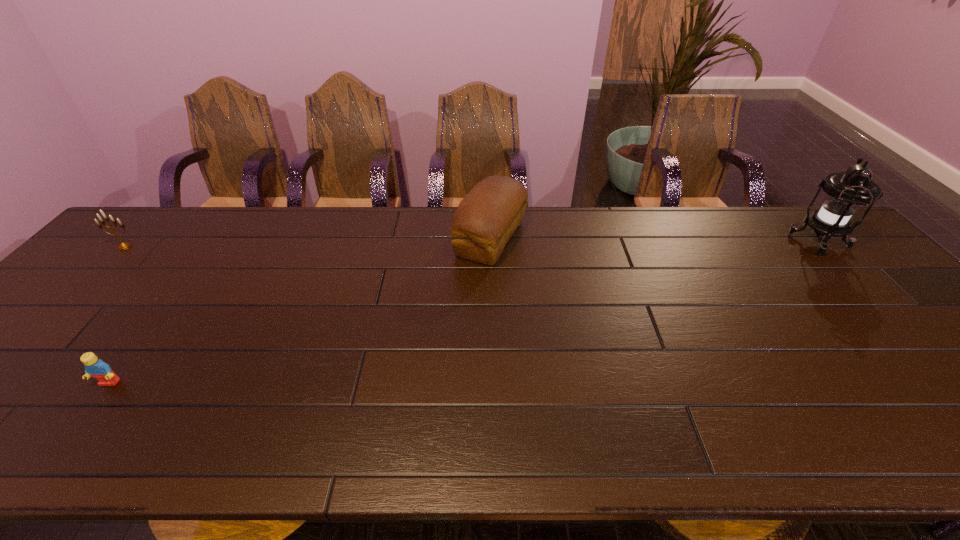
Locate an element on the screen. This screenshot has width=960, height=540. the rightmost object is located at coordinates (846, 191).

Where is `the tallest object`? This screenshot has width=960, height=540. the tallest object is located at coordinates (846, 191).

Locate an element on the screen. the third shortest object is located at coordinates (488, 216).

This screenshot has height=540, width=960. I want to click on bread, so click(x=488, y=216).

The image size is (960, 540). I want to click on candelabrum, so click(x=123, y=246).

This screenshot has width=960, height=540. In order to click on the second shortest object in this screenshot , I will do `click(123, 246)`.

You are a GUI agent. You are given a task and a screenshot of the screen. Output one action in this format:
    pyautogui.click(x=<x>, y=<y>)
    Task: Click on the third object from right to left
    This screenshot has height=540, width=960.
    Given the screenshot: What is the action you would take?
    [95, 367]

Where is `the nearest object`? The height and width of the screenshot is (540, 960). the nearest object is located at coordinates (95, 367).

This screenshot has width=960, height=540. I want to click on vacant region located 0.060m on the front of the lantern, so (849, 275).

You are a GUI agent. You are given a task and a screenshot of the screen. Output one action in this format:
    pyautogui.click(x=<x>, y=<y>)
    Task: Click on the vacant space located 0.260m on the left of the bread
    This screenshot has height=540, width=960.
    Given the screenshot: What is the action you would take?
    pyautogui.click(x=369, y=239)